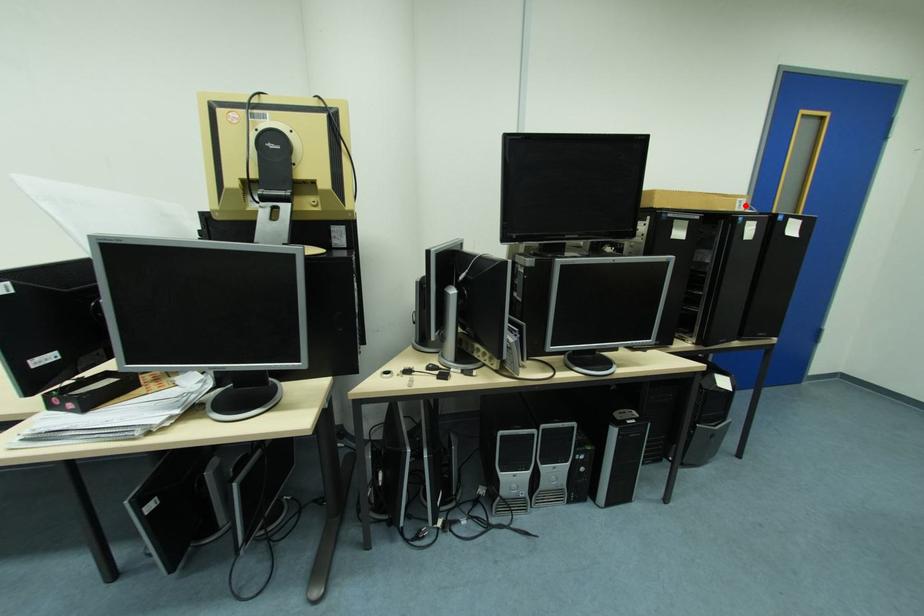
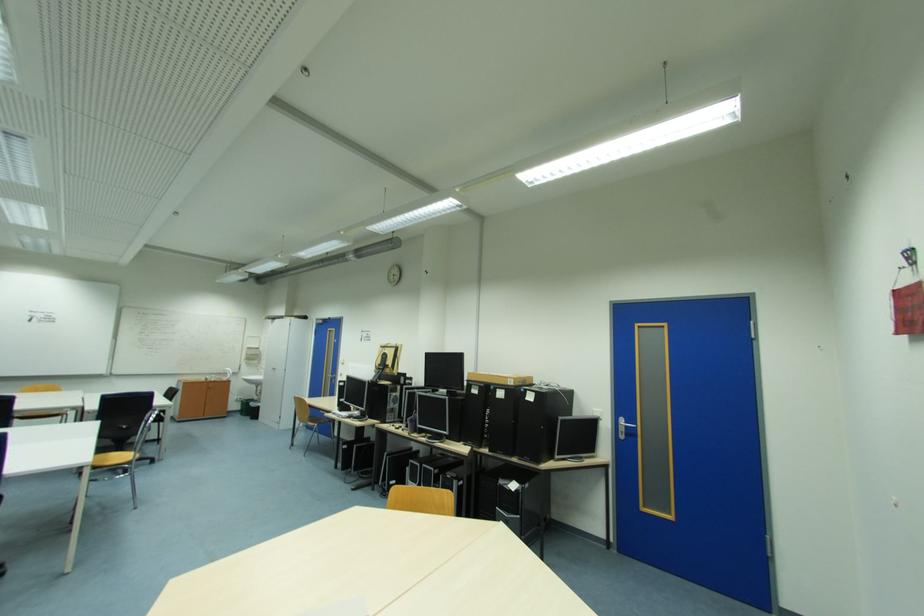
Find the pixel in the second image that matches the highlighted location in the first image.

(517, 382)